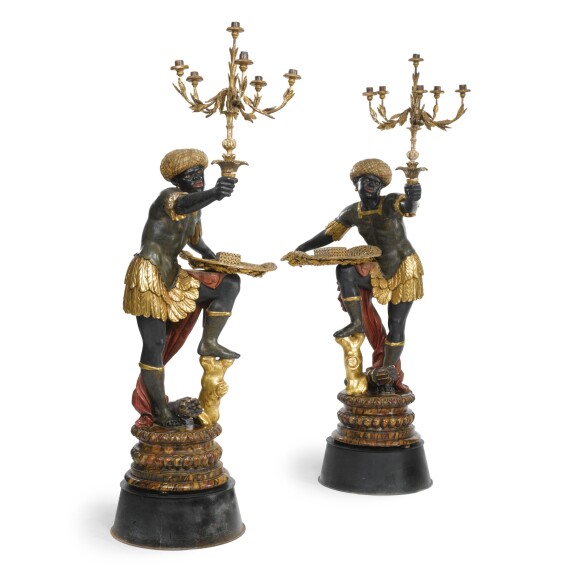
Where is `candelabra`? This screenshot has width=566, height=566. candelabra is located at coordinates (228, 93), (409, 109).